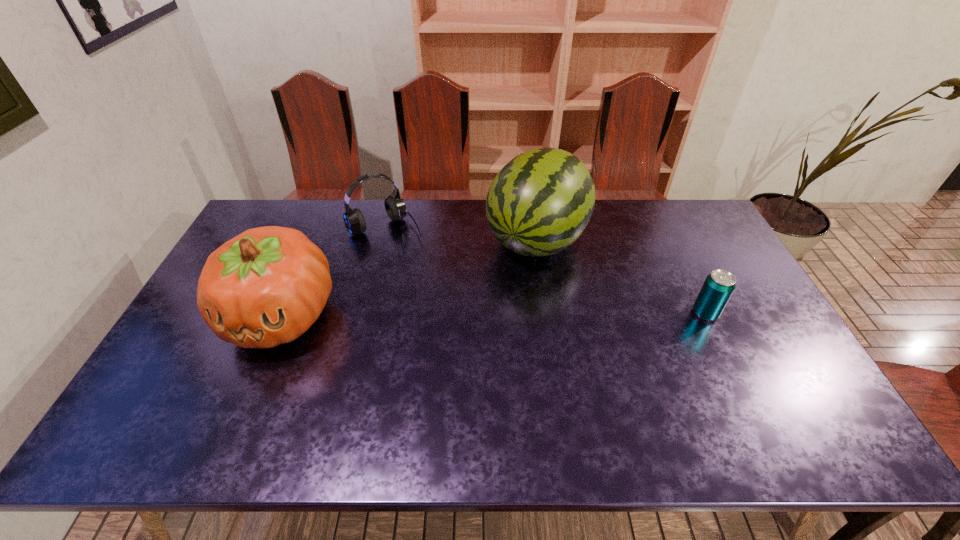
The height and width of the screenshot is (540, 960). In order to click on pumpkin in this screenshot , I will do `click(265, 287)`.

Find the location of `the rightmost object`. the rightmost object is located at coordinates (718, 287).

This screenshot has height=540, width=960. In order to click on the shortest object in this screenshot , I will do `click(718, 287)`.

Identify the location of headset. Image resolution: width=960 pixels, height=540 pixels. (395, 207).

You are a GUI agent. You are given a task and a screenshot of the screen. Output one action in this format:
    pyautogui.click(x=<x>, y=<y>)
    Task: Click on the watermelon
    This screenshot has width=960, height=540.
    Given the screenshot: What is the action you would take?
    pyautogui.click(x=539, y=203)

This screenshot has height=540, width=960. I want to click on vacant point located 0.360m on the back of the shortest object, so click(664, 229).

Identify the location of vacant area situated on the ear cushions of the third tallest object. (416, 254).

This screenshot has height=540, width=960. Find the location of `free point located 0.340m on the ear cushions of the third tallest object`. free point located 0.340m on the ear cushions of the third tallest object is located at coordinates (453, 301).

Find the location of a particular element. free location located on the ear cushions of the third tallest object is located at coordinates (419, 258).

Where is `free spot located at the stem end of the watermelon`? free spot located at the stem end of the watermelon is located at coordinates tap(495, 297).